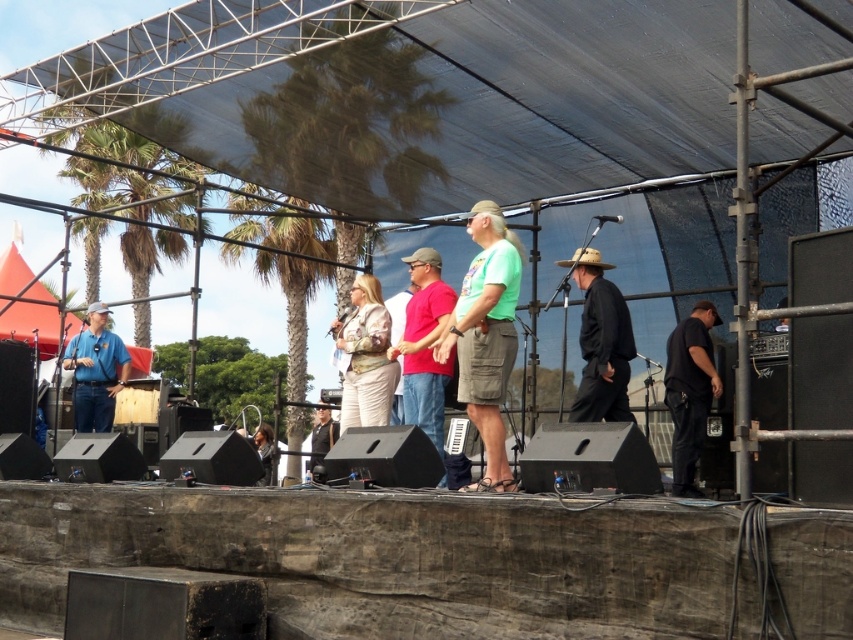
The image size is (853, 640). What do you see at coordinates (601, 342) in the screenshot?
I see `black cotton shirt at center` at bounding box center [601, 342].

Does black cotton shirt at center have a lesser height compared to black matte pants at right?

Correct, black cotton shirt at center is not as tall as black matte pants at right.

Does point (589, 390) come behind point (688, 448)?

No.

Find the location of a particular element. black cotton shirt at center is located at coordinates (601, 342).

Consider the image. Who is positioned more to the right, matte white blouse at center or black leather jacket at center?

matte white blouse at center

Who is higher up, matte white blouse at center or black leather jacket at center?

Positioned higher is matte white blouse at center.

Who is more forward, [364,280] or [315,461]?

Point [364,280] is in front.

The image size is (853, 640). Find the location of `matte white blouse at center`. matte white blouse at center is located at coordinates (366, 356).

Does black matte pants at right lie behind matte white blouse at center?

That is False.

Is black matte pants at right thinner than matte white blouse at center?

Correct, black matte pants at right's width is less than matte white blouse at center's.

Is point (680, 337) farther from camera compared to point (343, 330)?

No, it is in front of (343, 330).

Identify the location of black matte pants at right. (689, 392).